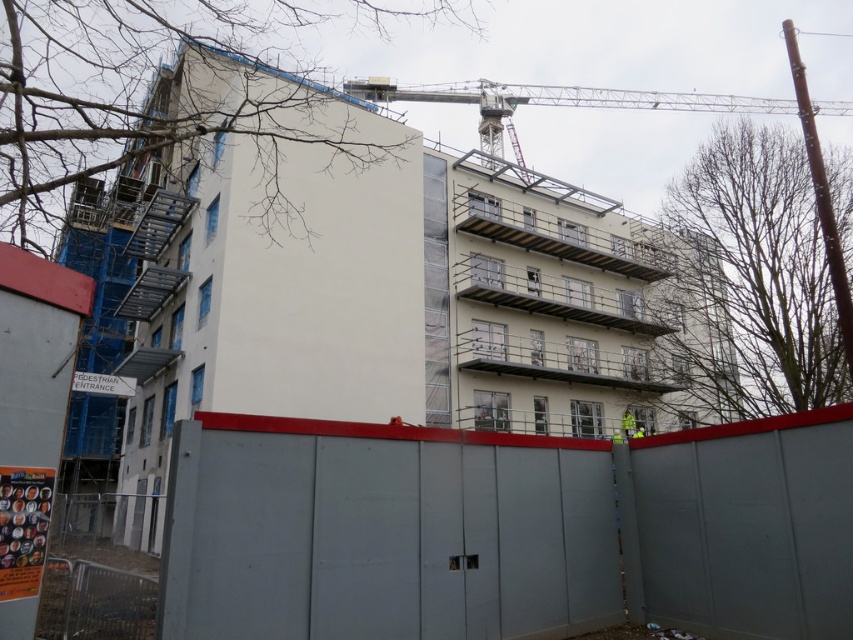
You are a delivery truck driver approaching the construction site. You need to pass through the area near the metallic silver crane at upper center and the metallic silver fence at lower left. Based on their positions, which object is higher from the ground?

The metallic silver crane at upper center is above the metallic silver fence at lower left, so it is higher from the ground.

You are a construction worker standing at the PROSTHAN ENTRANCE. You need to move the metallic silver crane at upper center to the location marked by point (x=554, y=100). Is the crane already at the correct location?

The point (x=554, y=100) marks the metallic silver crane at upper center, so the crane is already at the correct location.

You are a construction worker who needs to move a heavy beam from the ground to the second floor of the building. The beam is as long as the gray metal fence at lower center. Can the metallic silver crane at upper center lift this beam without any issues?

The gray metal fence at lower center is smaller than the metallic silver crane at upper center. Since the beam is as long as the fence, the crane can easily lift it without any issues because it is larger and more capable than the fence.